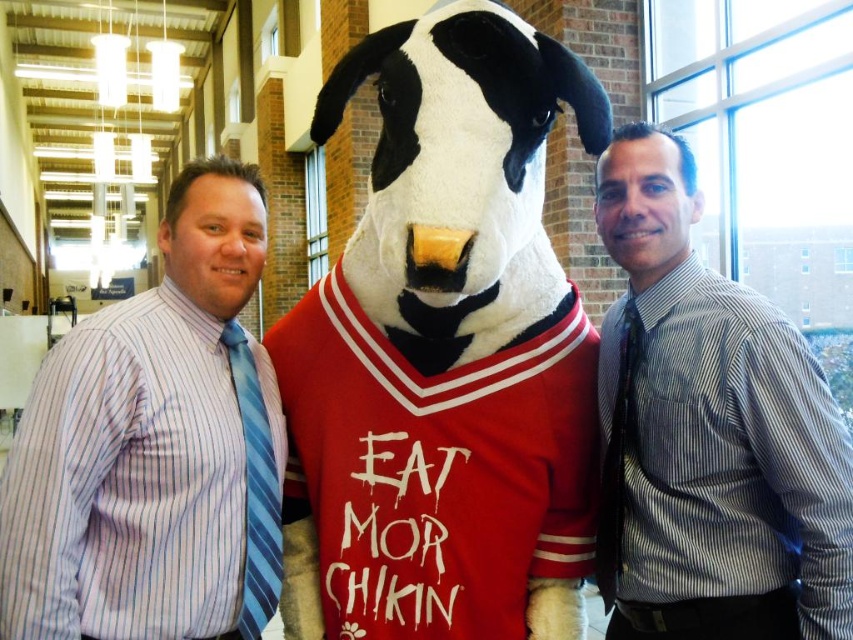
Does striped shirt at right have a smaller size compared to blue striped tie at left?

Actually, striped shirt at right might be larger than blue striped tie at left.

Which is more to the left, striped shirt at right or blue striped tie at left?

From the viewer's perspective, blue striped tie at left appears more on the left side.

Measure the distance between striped shirt at right and camera.

striped shirt at right and camera are 1.76 meters apart.

This screenshot has height=640, width=853. What are the coordinates of `striped shirt at right` in the screenshot? It's located at (711, 432).

Is blue striped shirt at left to the right of blue striped tie at left from the viewer's perspective?

Incorrect, blue striped shirt at left is not on the right side of blue striped tie at left.

This screenshot has height=640, width=853. What are the coordinates of `blue striped shirt at left` in the screenshot? It's located at (154, 448).

Identify the location of blue striped shirt at left. (154, 448).

Can you confirm if blue striped shirt at left is smaller than striped shirt at right?

Incorrect, blue striped shirt at left is not smaller in size than striped shirt at right.

Does point (190, 410) lie in front of point (650, 476)?

Yes, it is in front of point (650, 476).

Locate an element on the screen. blue striped shirt at left is located at coordinates (154, 448).